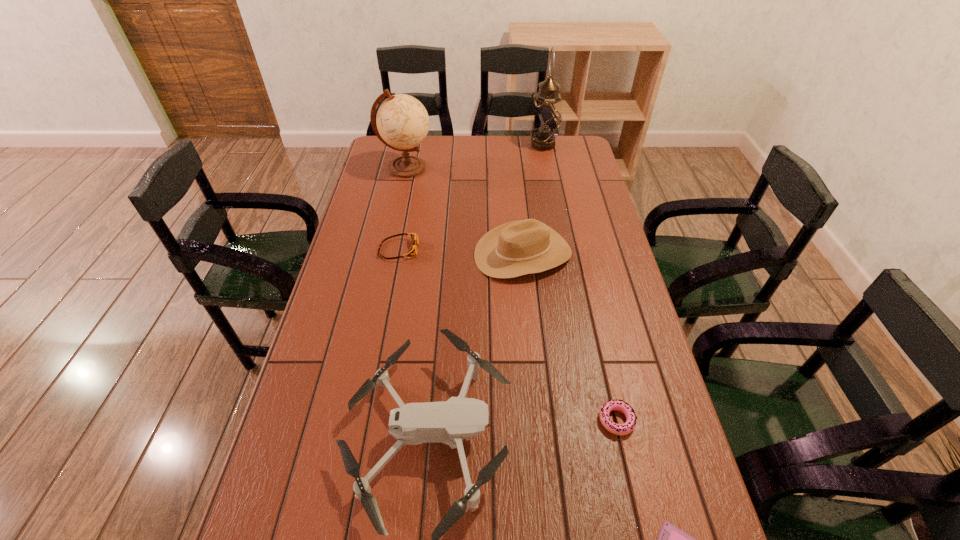
Locate an element on the screen. vacant space at the far edge is located at coordinates coord(506,158).

Locate an element on the screen. vacant space at the left edge of the desktop is located at coordinates (376, 179).

Find the location of a particular element. This screenshot has height=540, width=960. vacant space at the right edge is located at coordinates (574, 228).

Find the location of a particular element. This screenshot has width=960, height=540. vacant space at the far left corner of the desktop is located at coordinates (385, 153).

Where is `free space between the cowboy hat and the second tallest object`? The width and height of the screenshot is (960, 540). free space between the cowboy hat and the second tallest object is located at coordinates tap(465, 211).

Locate an element on the screen. This screenshot has width=960, height=540. object that can be found as the fifth closest to the oil lamp is located at coordinates (619, 405).

The image size is (960, 540). Identify the location of the third closest object to the farthest object. (412, 251).

In order to click on vacant position in the image that satisfies the following two spatial constraints: 1. on the surface of the sixth nearest object; 2. on the back side of the doughnut in this screenshot , I will do `click(352, 420)`.

This screenshot has width=960, height=540. Find the location of `vacant space that satisfies the following two spatial constraints: 1. on the front side of the tallest object; 2. with the lenses facing forward on the fifth tallest object`. vacant space that satisfies the following two spatial constraints: 1. on the front side of the tallest object; 2. with the lenses facing forward on the fifth tallest object is located at coordinates (564, 249).

Find the location of a particular element. This screenshot has height=540, width=960. free spot that satisfies the following two spatial constraints: 1. with the lenses facing forward on the goggles; 2. on the back side of the cowboy hat is located at coordinates (397, 254).